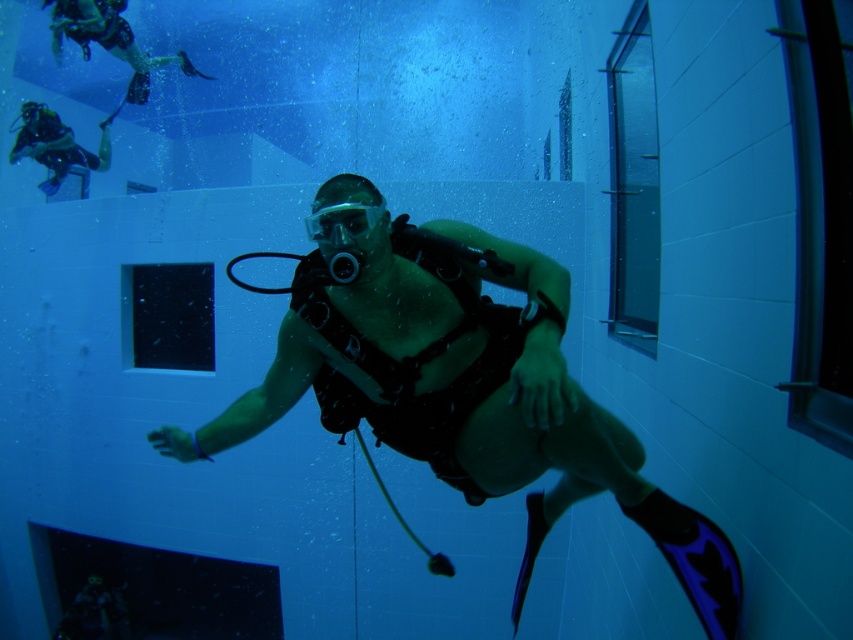
You are a scuba diver in the training facility. You notice two points marked in the water. One is at point (457,268) and the other at point (360,216). If you are facing the direction of the training module, which point is closer to the training module?

Point (457,268) is behind point (360,216). Since you are facing the training module, the point that is behind would be farther away from the training module. Therefore, point (360,216) is closer to the training module.

You are a scuba instructor observing the underwater scene. You need to check if the clear plastic goggles at center are within reach of the diver without them having to move their arms. Based on their positions relative to the matte black scuba gear at center, can you determine this?

The matte black scuba gear at center is closer to the viewer than the clear plastic goggles at center, so the goggles are farther away from the diver. Therefore, the diver would need to extend their arms to reach the clear plastic goggles at center.

You are a scuba instructor observing a diver in the training facility. The diver has two items at the center of your view. Which item is taller between the matte black scuba gear at center and the clear plastic goggles at center?

The matte black scuba gear at center is much taller than the clear plastic goggles at center.